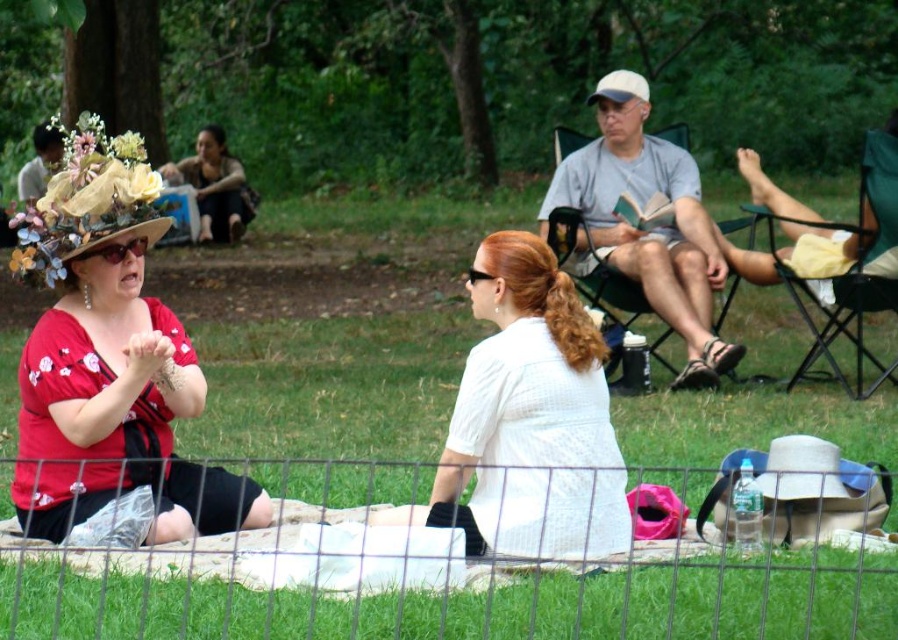
Question: Which object appears closest to the camera in this image?

Choices:
 (A) white fabric flower at upper left
 (B) metal wire fence at lower center
 (C) matte floral hat at left
 (D) white textured shirt at center

Answer: (B)

Question: Can you confirm if metal wire fence at lower center is positioned to the right of matte black dress at upper left?

Choices:
 (A) yes
 (B) no

Answer: (A)

Question: Considering the real-world distances, which object is farthest from the gray cotton shirt at center?

Choices:
 (A) white textured shirt at center
 (B) matte black dress at upper left
 (C) matte floral hat at left
 (D) white fabric flower at upper left

Answer: (B)

Question: Estimate the real-world distances between objects in this image. Which object is farther from the matte floral hat at upper left?

Choices:
 (A) matte black dress at upper left
 (B) metal wire fence at lower center
 (C) floral fabric hat at upper left

Answer: (B)

Question: Is metal wire fence at lower center behind matte floral hat at left?

Choices:
 (A) yes
 (B) no

Answer: (B)

Question: Is metal wire fence at lower center below matte floral hat at upper left?

Choices:
 (A) yes
 (B) no

Answer: (A)